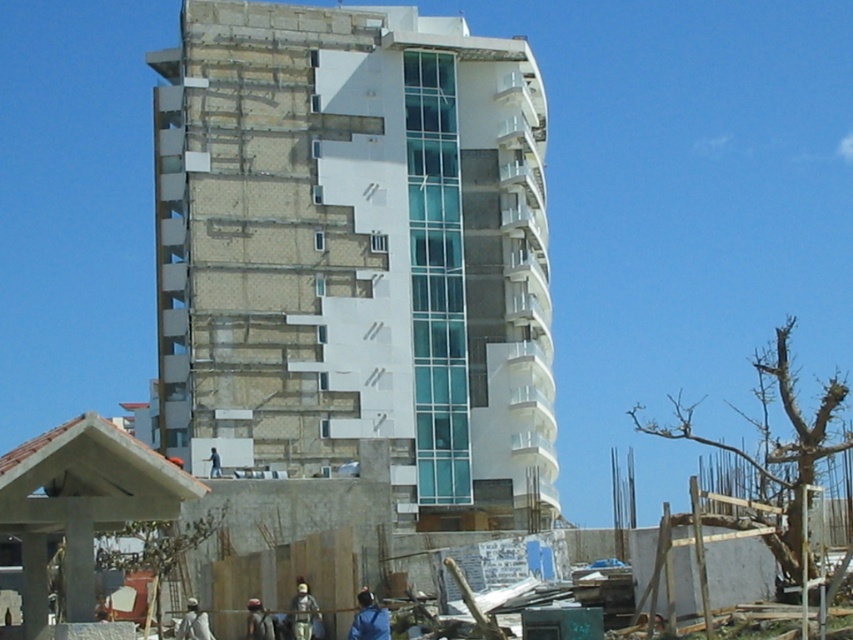
You are a construction inspector standing at the base of the multi story building under construction. You notice two points marked on the facade. The first point is at coordinate point (263, 634) and the second is at point (216, 449). Which point is closer to you?

Point (263, 634) is closer to the viewer than point (216, 449).

Based on the scene description, what does the point at coordinates (x=357, y=253) represent?

The point at coordinates (x=357, y=253) indicates the white concrete building at center.